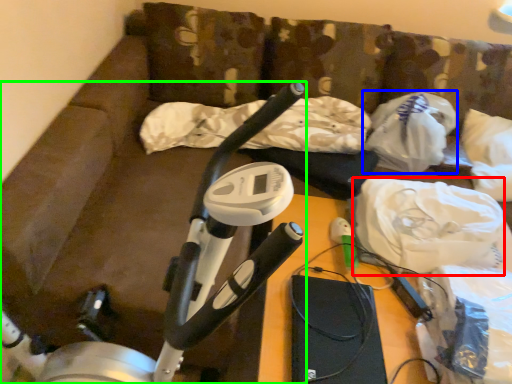
Question: Based on their relative distances, which object is farther from material (highlighted by a red box)? Choose from plastic bag (highlighted by a blue box) and stationary bicycle (highlighted by a green box).

Choices:
 (A) plastic bag
 (B) stationary bicycle

Answer: (B)